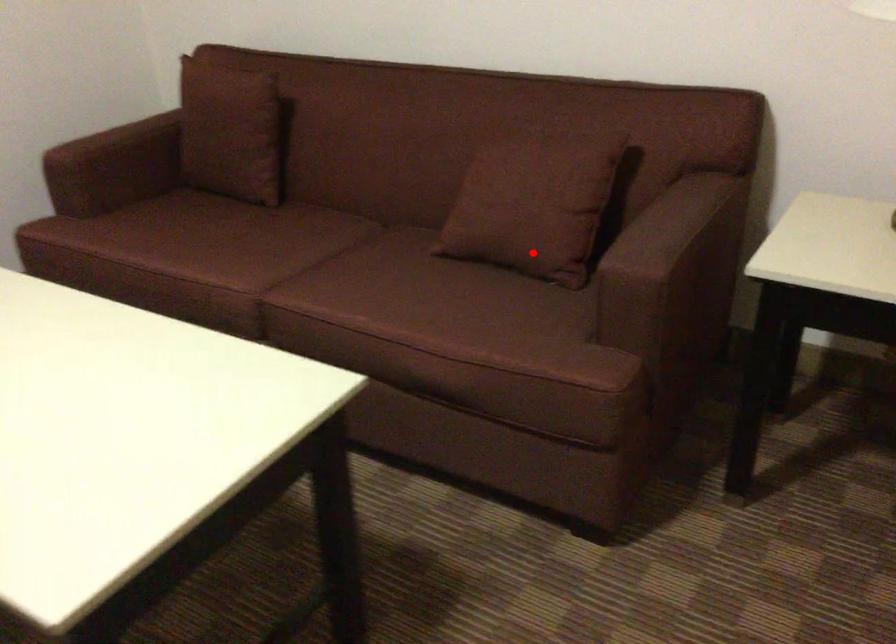
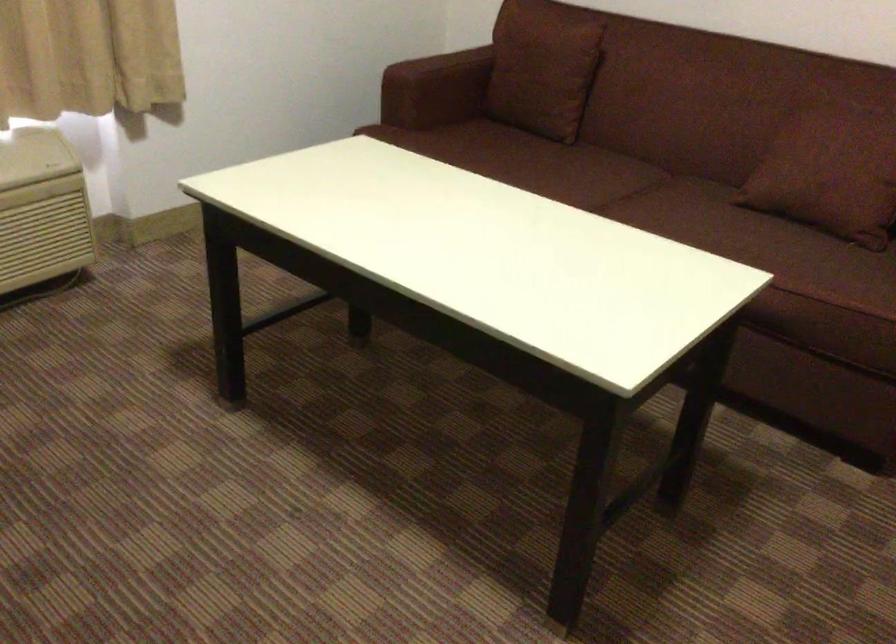
Find the pixel in the second image that matches the highlighted location in the first image.

(842, 207)